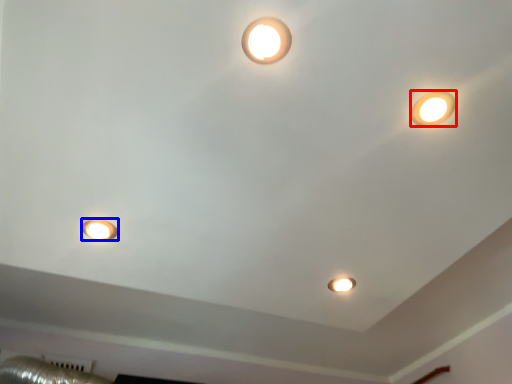
Question: Which object is closer to the camera taking this photo, lamp (highlighted by a red box) or lamp (highlighted by a blue box)?

Choices:
 (A) lamp
 (B) lamp

Answer: (A)